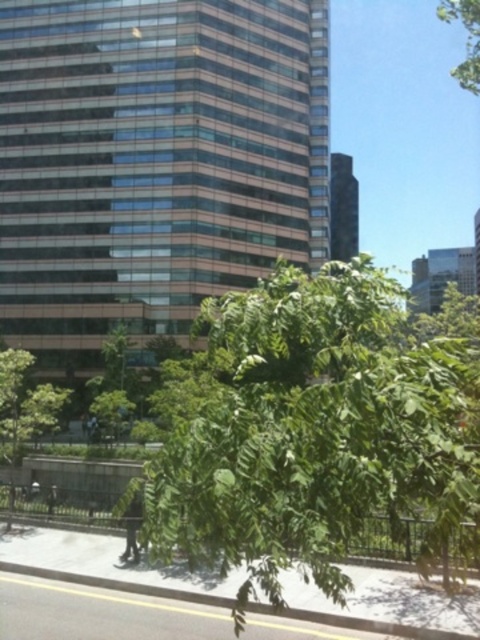
This screenshot has height=640, width=480. Find the location of `glassy brown building at center`. glassy brown building at center is located at coordinates click(x=154, y=163).

Which is above, glassy brown building at center or green leafy tree at center?

glassy brown building at center is above.

Looking at this image, who is more forward, (49, 188) or (189, 532)?

Point (189, 532) is in front.

Find the location of a particular element. The image size is (480, 640). glassy brown building at center is located at coordinates (154, 163).